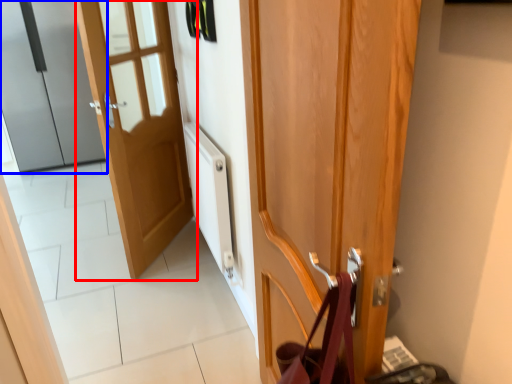
Question: Which of the following is the closest to the observer, door (highlighted by a red box) or door (highlighted by a blue box)?

Choices:
 (A) door
 (B) door

Answer: (A)